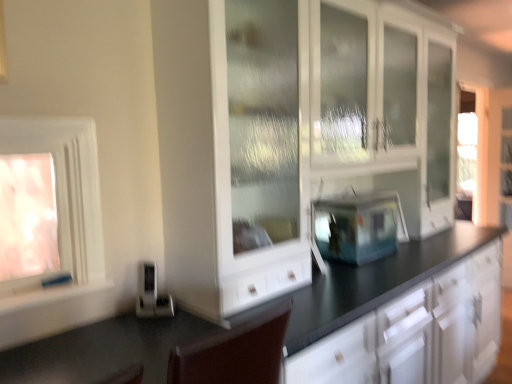
Question: From a real-world perspective, is white glossy cabinet at center beneath white matte window sill at lower left?

Choices:
 (A) no
 (B) yes

Answer: (A)

Question: Does white glossy cabinet at center have a lesser height compared to white matte window sill at lower left?

Choices:
 (A) yes
 (B) no

Answer: (B)

Question: Is white glossy cabinet at center smaller than white matte window sill at lower left?

Choices:
 (A) no
 (B) yes

Answer: (A)

Question: Is white glossy cabinet at center aimed at white matte window sill at lower left?

Choices:
 (A) yes
 (B) no

Answer: (B)

Question: Does white glossy cabinet at center touch white matte window sill at lower left?

Choices:
 (A) no
 (B) yes

Answer: (A)

Question: Does white glossy cabinet at center lie behind white matte window sill at lower left?

Choices:
 (A) no
 (B) yes

Answer: (A)

Question: Does white glossy cabinet at center appear on the left side of satin silver toaster at lower left, the 1th appliance from the left?

Choices:
 (A) no
 (B) yes

Answer: (A)

Question: Can you confirm if white glossy cabinet at center is positioned to the right of satin silver toaster at lower left, the first appliance when ordered from front to back?

Choices:
 (A) no
 (B) yes

Answer: (B)

Question: Considering the relative sizes of white glossy cabinet at center and satin silver toaster at lower left, the first appliance when ordered from front to back, in the image provided, is white glossy cabinet at center shorter than satin silver toaster at lower left, the first appliance when ordered from front to back,?

Choices:
 (A) no
 (B) yes

Answer: (A)

Question: Does white glossy cabinet at center come behind satin silver toaster at lower left, the first appliance when ordered from front to back?

Choices:
 (A) yes
 (B) no

Answer: (B)

Question: Considering the relative sizes of white glossy cabinet at center and satin silver toaster at lower left, which appears as the 2th appliance when viewed from the back, in the image provided, is white glossy cabinet at center smaller than satin silver toaster at lower left, which appears as the 2th appliance when viewed from the back,?

Choices:
 (A) no
 (B) yes

Answer: (A)

Question: Considering the relative sizes of white glossy cabinet at center and satin silver toaster at lower left, the first appliance when ordered from front to back, in the image provided, is white glossy cabinet at center bigger than satin silver toaster at lower left, the first appliance when ordered from front to back,?

Choices:
 (A) no
 (B) yes

Answer: (B)

Question: From the image's perspective, is white glossy window at left, placed as the 2th window when sorted from left to right, below white glossy cabinet at center?

Choices:
 (A) yes
 (B) no

Answer: (B)